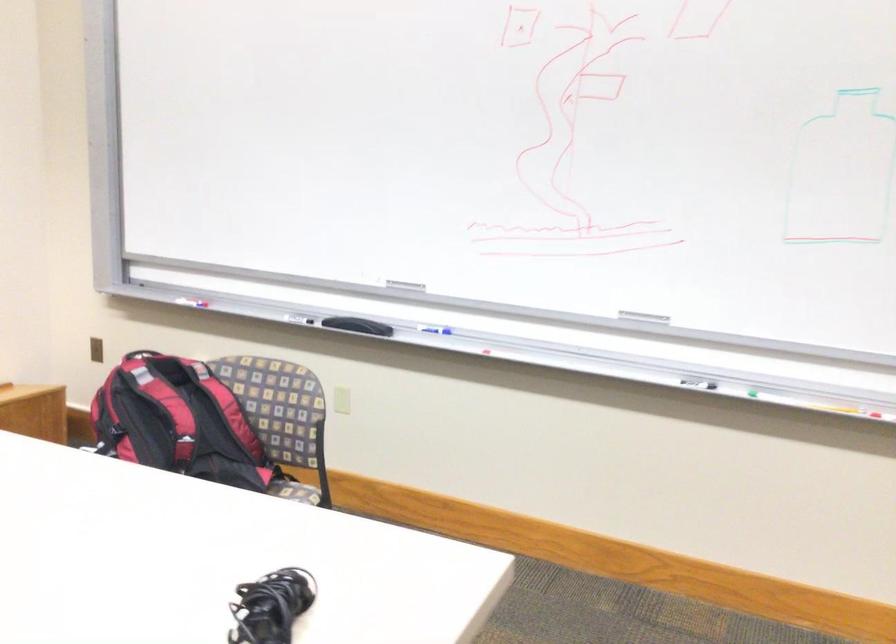
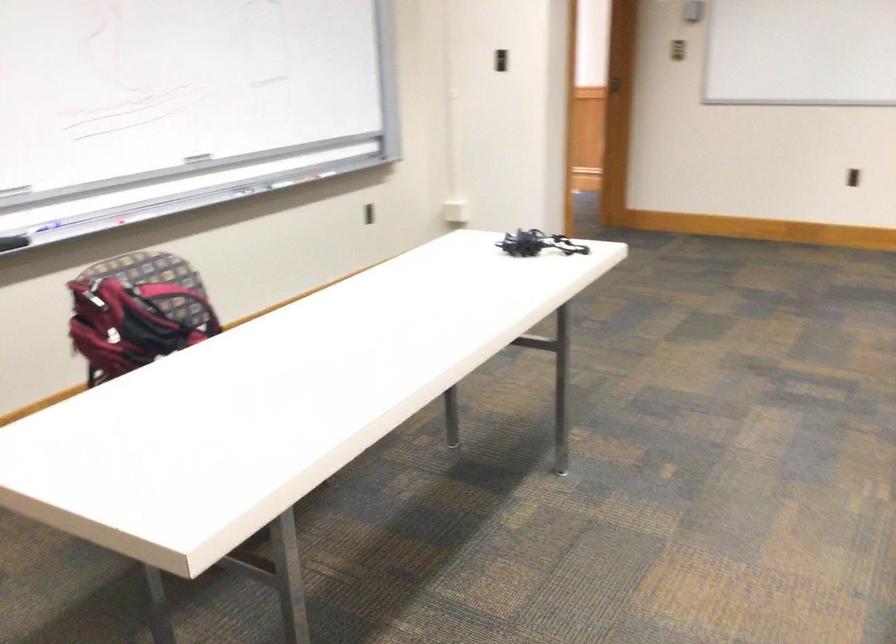
In the second image, find the point that corresponds to pixel 302 431 in the first image.

(177, 301)